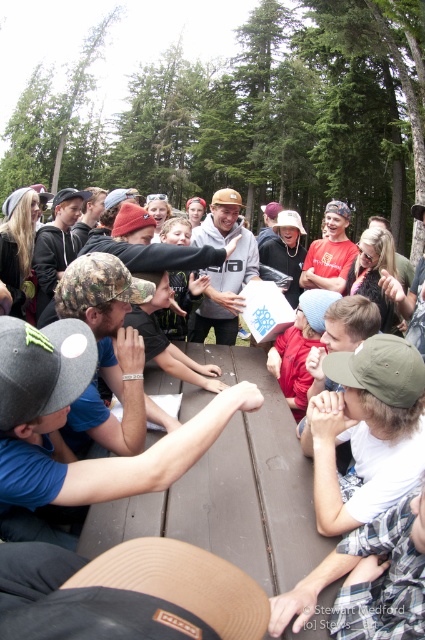
You are organizing a photo shoot and need to ensure that the blue fabric cap at center and the matte gray hoodie at center are visible in the frame. Given their sizes, which object should you prioritize positioning closer to the camera to maintain clarity?

The blue fabric cap at center should be positioned closer to the camera since its width is larger than the matte gray hoodie at center, ensuring both objects remain clear and in focus.

You are a photographer standing at the edge of the picnic table. You want to take a photo that includes both the blue fabric cap at center and the matte gray hoodie at center. If your camera has a maximum focus range of 6 feet, will both subjects be in focus?

The blue fabric cap at center is 6.30 feet from matte gray hoodie at center. Since the distance between them is slightly over 6 feet, the camera might struggle to keep both in focus simultaneously.

You are standing at the edge of the campsite and want to locate the blue fabric cap at center. According to the coordinates given, where would you look relative to the center of the image?

The blue fabric cap at center is located at coordinates point (x=65, y=422), which is to the right and slightly below the center of the image.